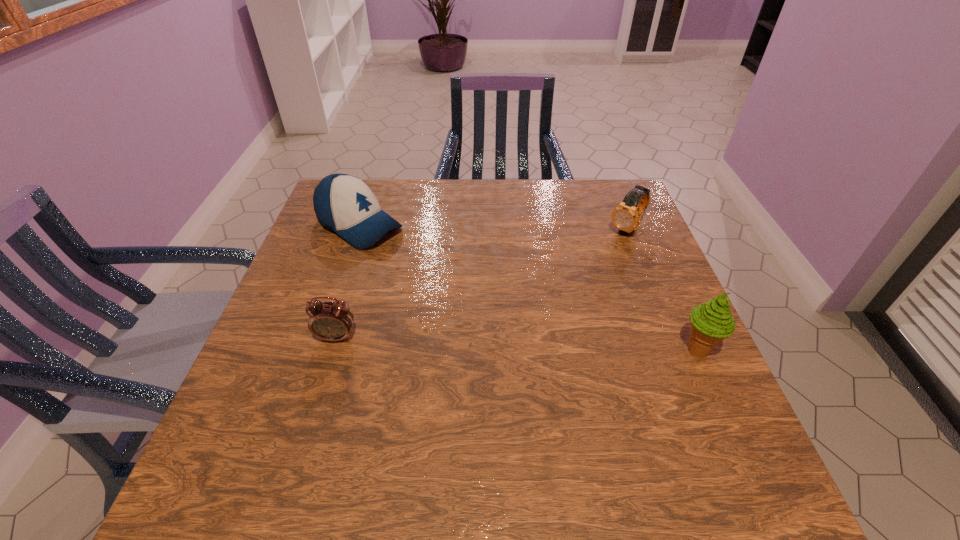
You are a GUI agent. You are given a task and a screenshot of the screen. Output one action in this format:
    pyautogui.click(x=<x>, y=<y>)
    Task: Click on the free location at the far edge of the desktop
    
    Given the screenshot: What is the action you would take?
    pyautogui.click(x=427, y=221)

Find the location of a particular element. vacant space at the near edge of the desktop is located at coordinates (394, 439).

Identify the location of blank area at the left edge. The height and width of the screenshot is (540, 960). (291, 376).

The width and height of the screenshot is (960, 540). In the image, there is a desktop. Find the location of `free region at the right edge`. free region at the right edge is located at coordinates (656, 354).

In the image, there is a desktop. At what (x,y) coordinates should I click in order to perform the action: click on blank space at the far right corner. Please return your answer as a coordinate pair (x, y). This screenshot has height=540, width=960. Looking at the image, I should click on (606, 190).

The width and height of the screenshot is (960, 540). I want to click on free space between the watch and the icecream, so click(x=661, y=289).

This screenshot has width=960, height=540. What are the coordinates of `vacant area that lies between the alarm clock and the watch` in the screenshot? It's located at (482, 283).

Where is `free point between the alarm clock and the watch`? free point between the alarm clock and the watch is located at coordinates (482, 283).

The height and width of the screenshot is (540, 960). In order to click on vacant space that is in between the icecream and the watch in this screenshot , I will do `click(661, 289)`.

Where is `free area in between the baseball cap and the watch`? free area in between the baseball cap and the watch is located at coordinates (493, 227).